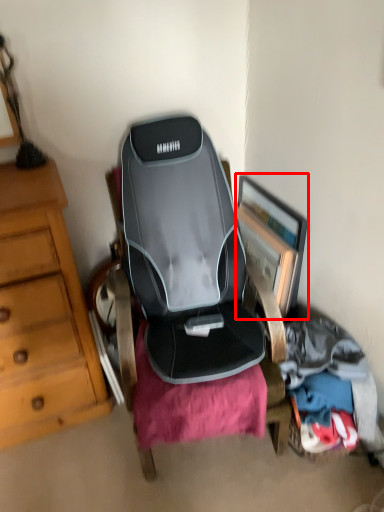
Question: From the image's perspective, what is the correct spatial relationship of picture frame (annotated by the red box) in relation to clothing?

Choices:
 (A) below
 (B) above

Answer: (B)